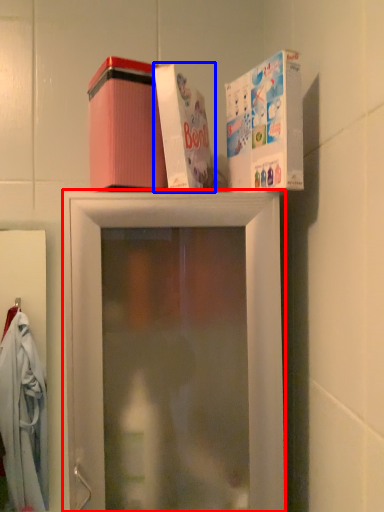
Question: Which point is further to the camera, shelf (highlighted by a red box) or box (highlighted by a blue box)?

Choices:
 (A) shelf
 (B) box

Answer: (B)